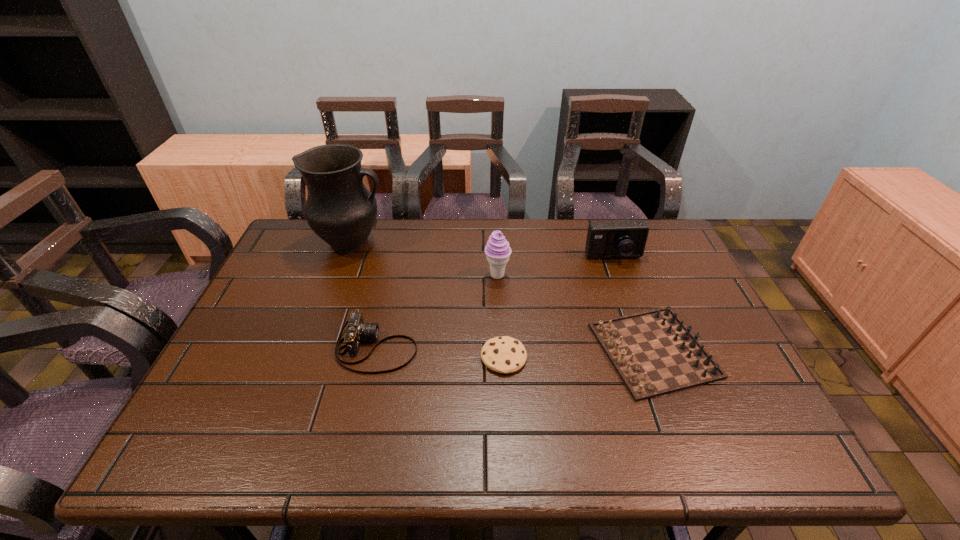
At what (x,y) coordinates should I click in order to perform the action: click on the tallest object. Please return your answer as a coordinate pair (x, y). This screenshot has height=540, width=960. Looking at the image, I should click on (x=339, y=209).

Identify the location of icecream. The image size is (960, 540). 497,250.

You are a GUI agent. You are given a task and a screenshot of the screen. Output one action in this format:
    pyautogui.click(x=<x>, y=<y>)
    Task: Click on the fourth nearest object
    This screenshot has height=540, width=960.
    Given the screenshot: What is the action you would take?
    pyautogui.click(x=497, y=250)

Find the location of a particular element. The height and width of the screenshot is (540, 960). the fourth shortest object is located at coordinates (621, 239).

The height and width of the screenshot is (540, 960). In order to click on the farther camera in this screenshot , I will do `click(621, 239)`.

Image resolution: width=960 pixels, height=540 pixels. In order to click on the shorter camera in this screenshot , I will do `click(356, 330)`.

Where is `the nearer camera`? The image size is (960, 540). the nearer camera is located at coordinates (356, 330).

Identify the location of chessboard. (654, 353).

This screenshot has height=540, width=960. What are the coordinates of `cookie` in the screenshot? It's located at (504, 354).

The height and width of the screenshot is (540, 960). In order to click on vacant space located 0.130m on the handle side of the pitcher in this screenshot , I will do `click(427, 242)`.